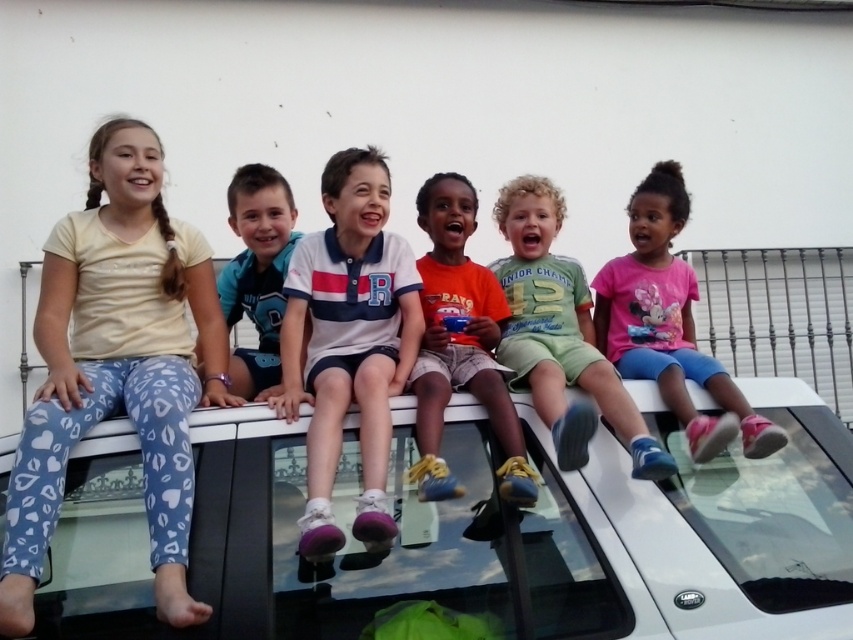
Question: Considering the real-world distances, which object is closest to the blue fabric shorts at center?

Choices:
 (A) pink cotton shirt at right
 (B) orange cotton shirt at center

Answer: (B)

Question: Can you confirm if light blue leggings at left is positioned to the left of white cotton shirt at center?

Choices:
 (A) yes
 (B) no

Answer: (A)

Question: Can you confirm if orange cotton shirt at center is positioned above blue fabric shorts at center?

Choices:
 (A) no
 (B) yes

Answer: (A)

Question: Which of the following is the closest to the observer?

Choices:
 (A) (419, 358)
 (B) (740, 403)
 (C) (251, 227)

Answer: (B)

Question: Among these objects, which one is farthest from the camera?

Choices:
 (A) orange cotton shirt at center
 (B) white glossy car at center
 (C) white cotton shirt at center

Answer: (A)

Question: Does white cotton shirt at center have a smaller size compared to blue fabric shorts at center?

Choices:
 (A) no
 (B) yes

Answer: (A)